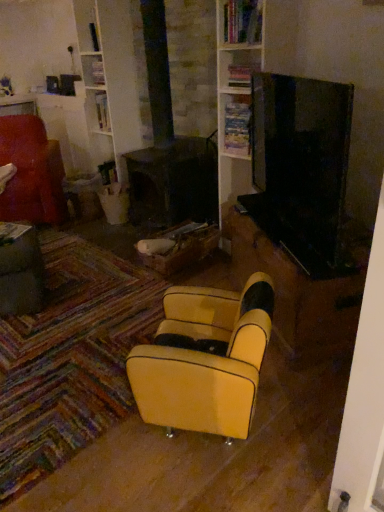
Locate an element on the screen. The width and height of the screenshot is (384, 512). free space in front of yellow leather chair at center, which is the 2th chair in top-to-bottom order is located at coordinates (212, 480).